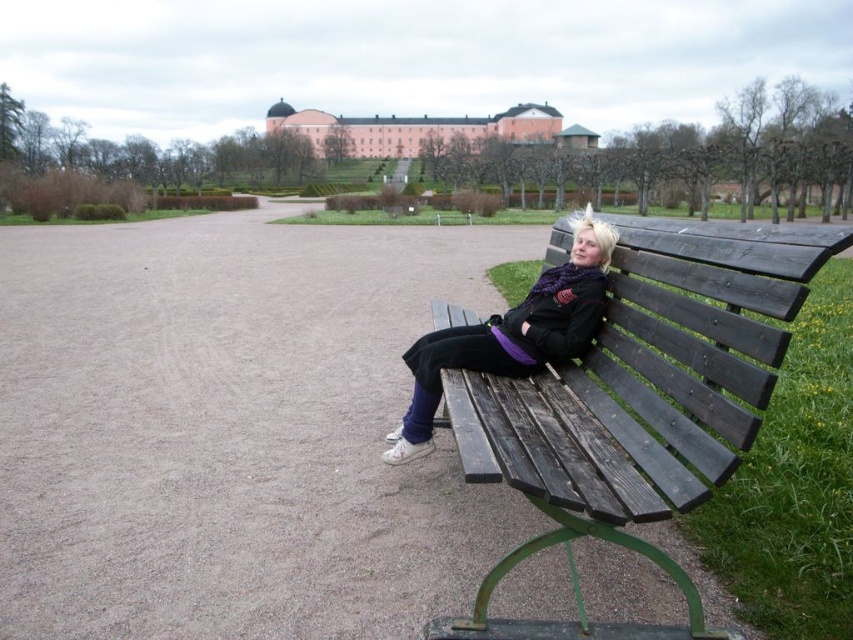
Is dark wood bench at right behind matte black jacket at center?

Answer: No, it is not.

Does dark wood bench at right have a lesser width compared to matte black jacket at center?

No, dark wood bench at right is not thinner than matte black jacket at center.

What do you see at coordinates (639, 401) in the screenshot?
I see `dark wood bench at right` at bounding box center [639, 401].

Find the location of `dark wood bench at right`. dark wood bench at right is located at coordinates (639, 401).

Which is behind, point (149, 429) or point (521, 312)?

Positioned behind is point (149, 429).

Between brown wooden bench at right and matte black jacket at center, which one appears on the right side from the viewer's perspective?

Positioned to the right is matte black jacket at center.

Does point (86, 508) come behind point (541, 321)?

That is False.

I want to click on brown wooden bench at right, so click(x=222, y=269).

Does dark wood bench at right have a smaller size compared to brown wooden bench at right?

Correct, dark wood bench at right occupies less space than brown wooden bench at right.

You are a GUI agent. You are given a task and a screenshot of the screen. Output one action in this format:
    pyautogui.click(x=<x>, y=<y>)
    Task: Click on the dark wood bench at right
    The image size is (853, 640).
    Given the screenshot: What is the action you would take?
    pyautogui.click(x=639, y=401)